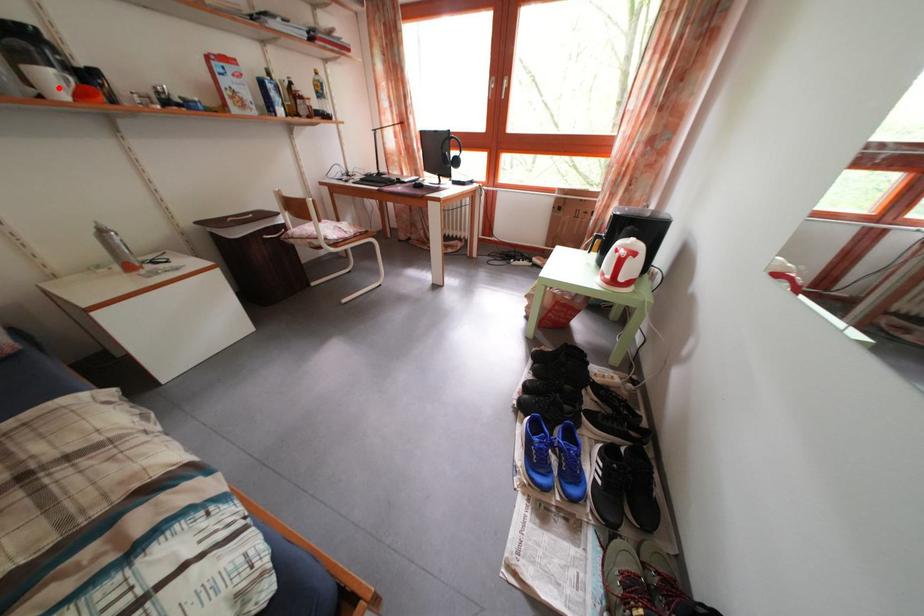
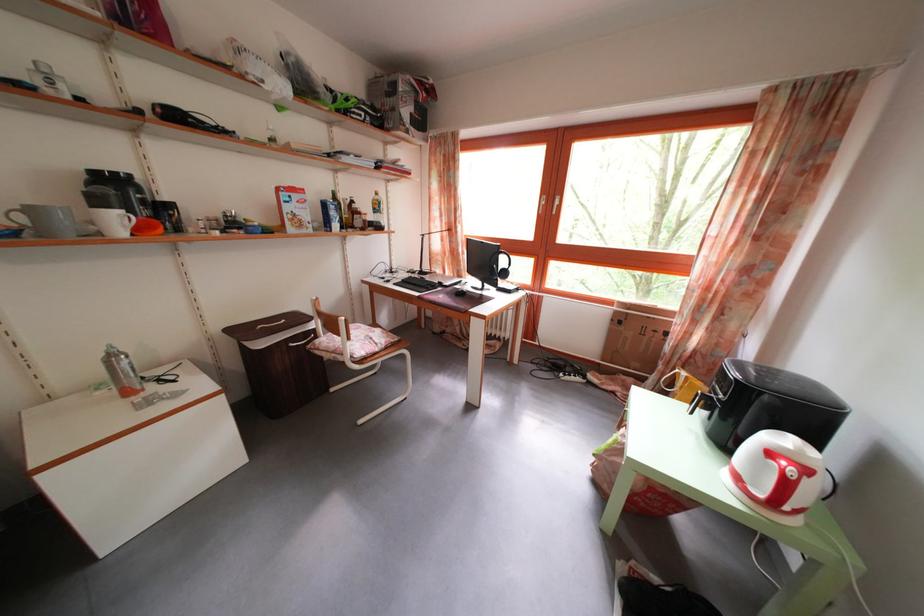
Question: I am providing you with two images of the same scene from different viewpoints. In image1, a red point is highlighted. Considering the same 3D point in image2, which of the following is correct?

Choices:
 (A) It is closer
 (B) It is farther

Answer: (A)